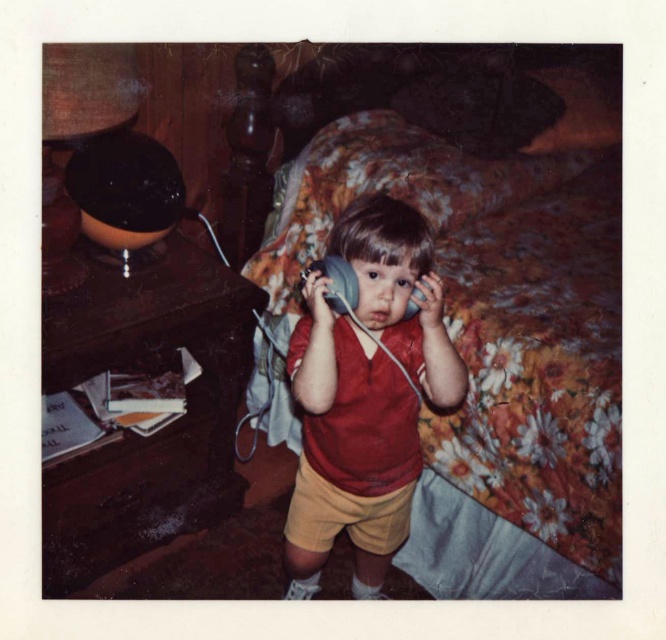
Question: Is floral fabric bed at center thinner than matte red shirt at center?

Choices:
 (A) yes
 (B) no

Answer: (B)

Question: Which object appears closest to the camera in this image?

Choices:
 (A) floral fabric bed at center
 (B) matte red shirt at center

Answer: (B)

Question: In this image, where is floral fabric bed at center located relative to matte red shirt at center?

Choices:
 (A) right
 (B) left

Answer: (A)

Question: Does floral fabric bed at center appear on the right side of matte red shirt at center?

Choices:
 (A) yes
 (B) no

Answer: (A)

Question: Among these points, which one is nearest to the camera?

Choices:
 (A) (388, 534)
 (B) (565, 268)

Answer: (A)

Question: Which point appears closest to the camera in this image?

Choices:
 (A) (569, 368)
 (B) (386, 259)

Answer: (B)